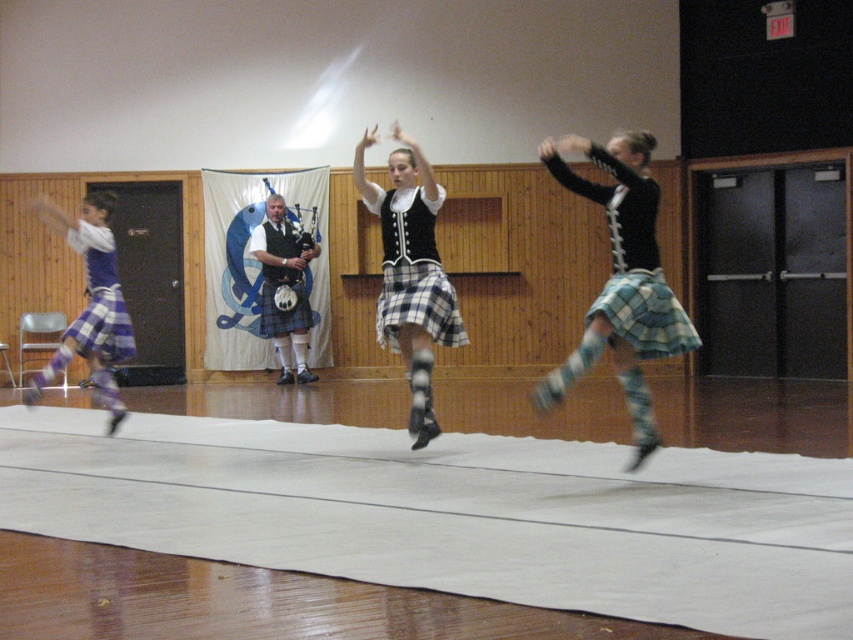
You are a photographer in the gymnasium and want to take a photo of the plaid skirt at center. The gym has a rule that photos can only be taken if the subject is within the central 50x50 cm area marked on the floor. Can you take the photo?

The plaid skirt at center is located at point (622, 282). Since the central area is 50x50 cm, and the coordinates are within the central area, yes, the photo can be taken.

You are a photographer standing in the gymnasium. You need to capture a photo that includes both the black plaid skirt at center and the plaid skirt at left. What is the minimum distance you should move backward to ensure both are in frame?

The black plaid skirt at center and the plaid skirt at left are 2.85 meters apart from each other. To include both in the frame, you should move back at least 2.85 meters to ensure the camera can capture the full distance between them.